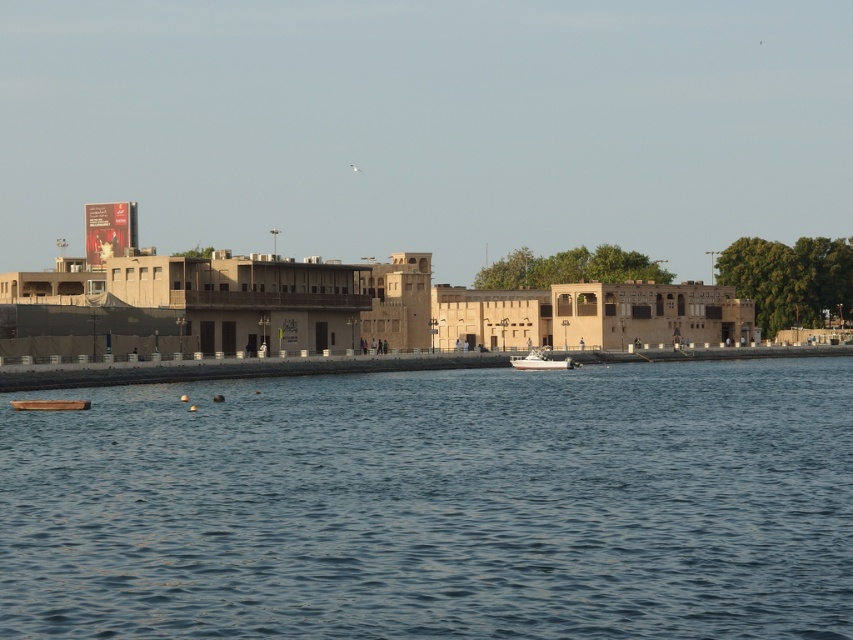
Which is in front, point (839, 401) or point (534, 369)?

Point (839, 401) is in front.

Can you confirm if blue water at lower center is bigger than white glossy boat at center?

Yes, blue water at lower center is bigger than white glossy boat at center.

At what (x,y) coordinates should I click in order to perform the action: click on blue water at lower center. Please return your answer as a coordinate pair (x, y). Image resolution: width=853 pixels, height=640 pixels. Looking at the image, I should click on (437, 506).

Image resolution: width=853 pixels, height=640 pixels. I want to click on blue water at lower center, so click(437, 506).